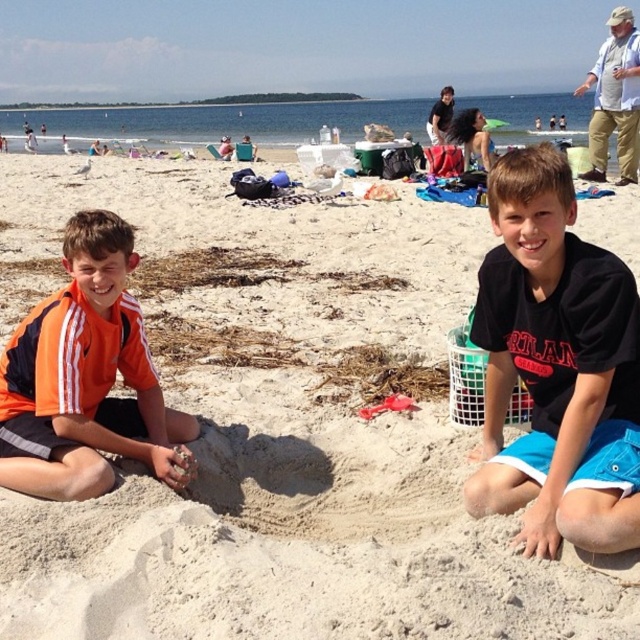
You are a photographer trying to capture a closeup of the black cotton shirt at center without the orange jersey at left blocking the view. Is this possible given their positions?

The black cotton shirt at center is in front of the orange jersey at left, so you can capture a closeup of the black cotton shirt at center without the orange jersey at left blocking the view.

You are a beachgoer who wants to borrow a larger shirt to cover up. You see the black cotton shirt at center and the orange jersey at left. Which one should you choose?

The black cotton shirt at center has a larger size compared to the orange jersey at left, so you should choose the black cotton shirt at center.